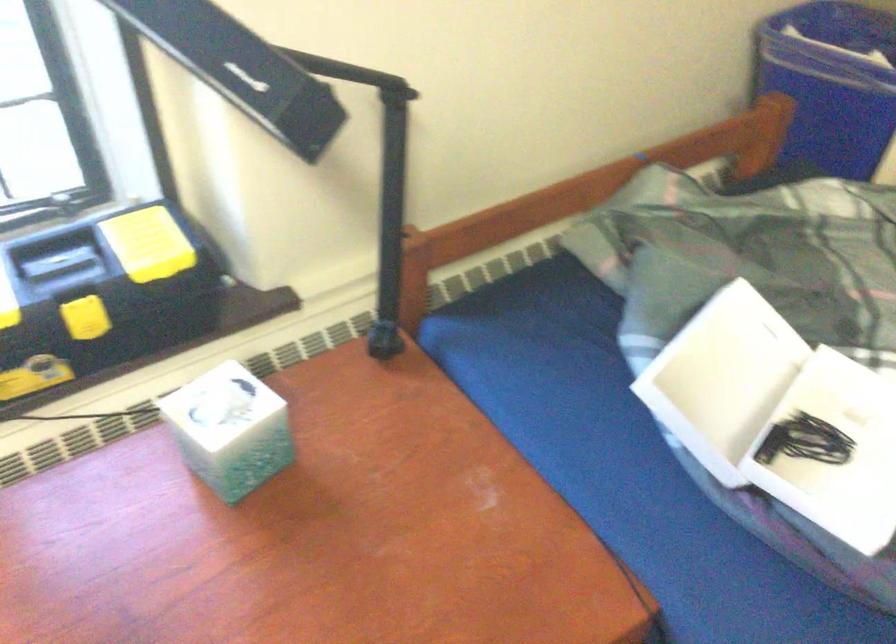
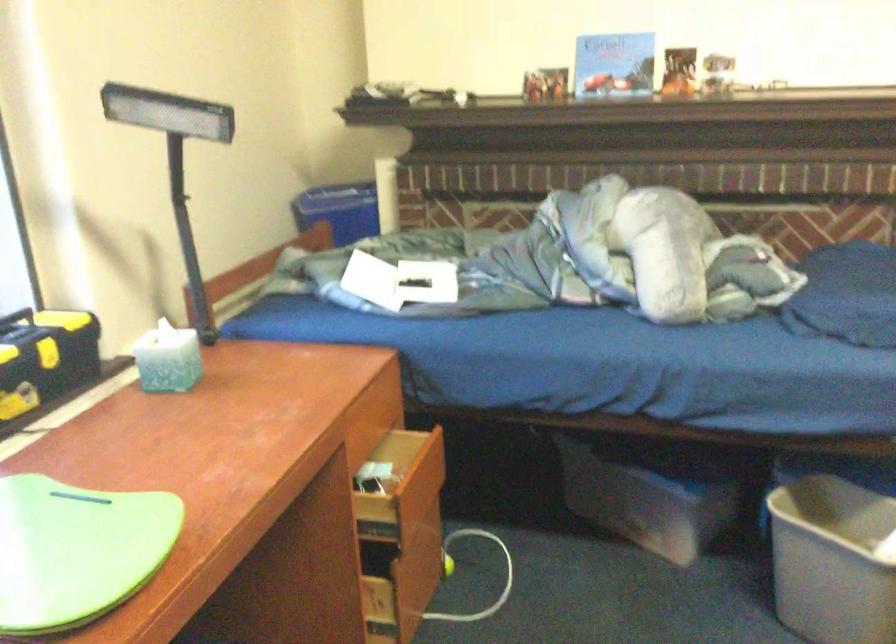
In the second image, find the point that corresponds to point (207, 471) in the first image.

(168, 359)